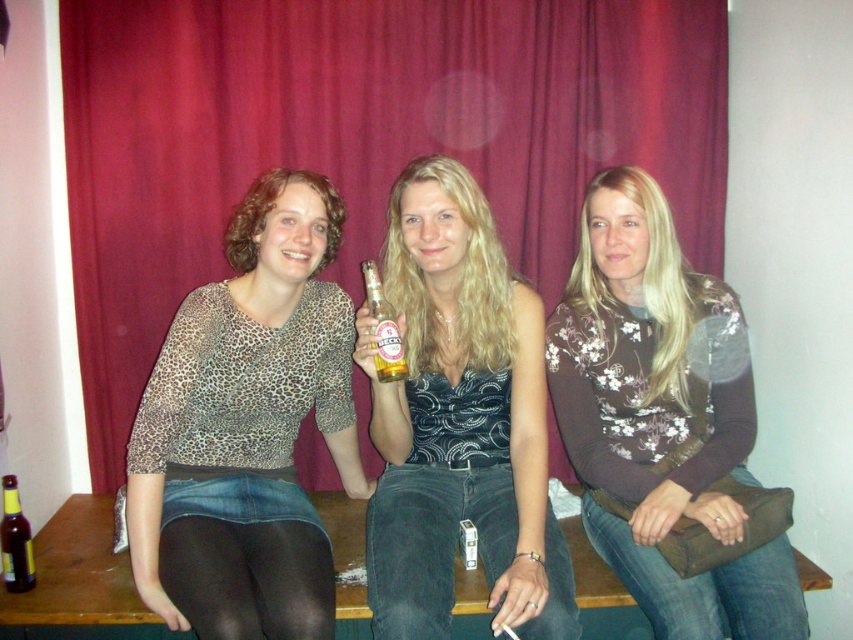
From the picture: You are a photographer trying to capture a group photo of the three women sitting on the bench. The red velvet curtain at upper center and the brown floral sweater at center are both in the frame. Which object should you focus on to ensure the subject is in focus?

The red velvet curtain at upper center is much taller than the brown floral sweater at center, so focusing on the red velvet curtain at upper center would ensure the subject is in focus since it is farther away and requires a different focal plane.

You are a photographer trying to capture a closeup shot of the shiny silver necklace at center and the brown glass bottle at lower left. Your camera can only focus on objects within 80 centimeters of each other. Will both items be in focus?

The shiny silver necklace at center and the brown glass bottle at lower left are 79.18 centimeters apart, so yes, both items will be in focus since the distance between them is within the camera focus range of 80 centimeters.

Consider the image. You are standing in front of the scene and want to know which of the two points, point (664,17) or point (726,536), is closer to you. Can you determine this based on their positions?

Point (664,17) is closer to you than point (726,536) because it is further to the camera, which means it is positioned nearer in the scene.